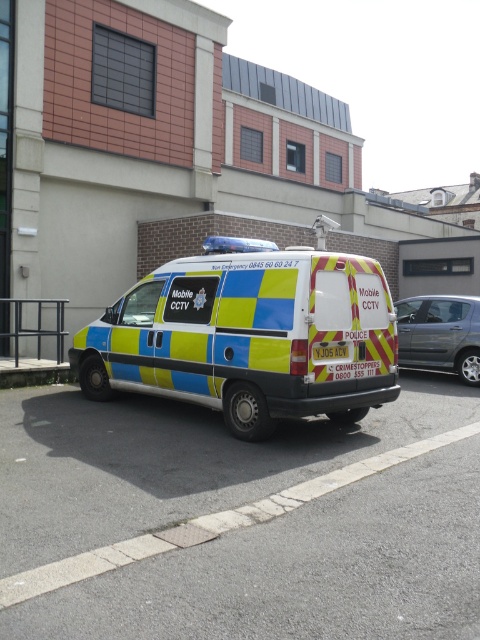
You are a city planner assessing vehicle sizes for parking lot design. You observe the yellow and blue checkered van at center and the metallic silver car at right in the image. Which vehicle requires more space in a parking spot?

The yellow and blue checkered van at center requires more space in a parking spot because it is larger in size than the metallic silver car at right.

You are a pedestrian standing on the sidewalk. You see a police van parked at the center with a distinctive blue and yellow checkered pattern. There is a point marked at coordinates [250,336]. Can you tell me what object this point is located on?

The point marked at coordinates [250,336] is located on the yellow and blue checkered van at center.